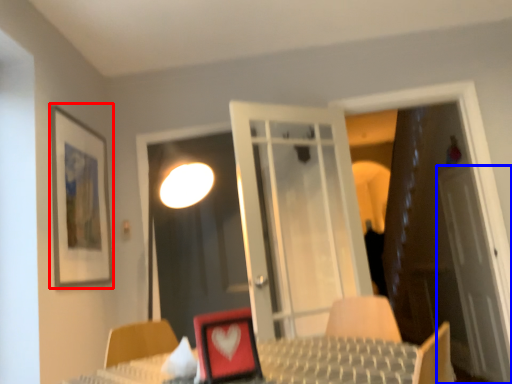
Question: Which object is closer to the camera taking this photo, picture frame (highlighted by a red box) or screen door (highlighted by a blue box)?

Choices:
 (A) picture frame
 (B) screen door

Answer: (A)